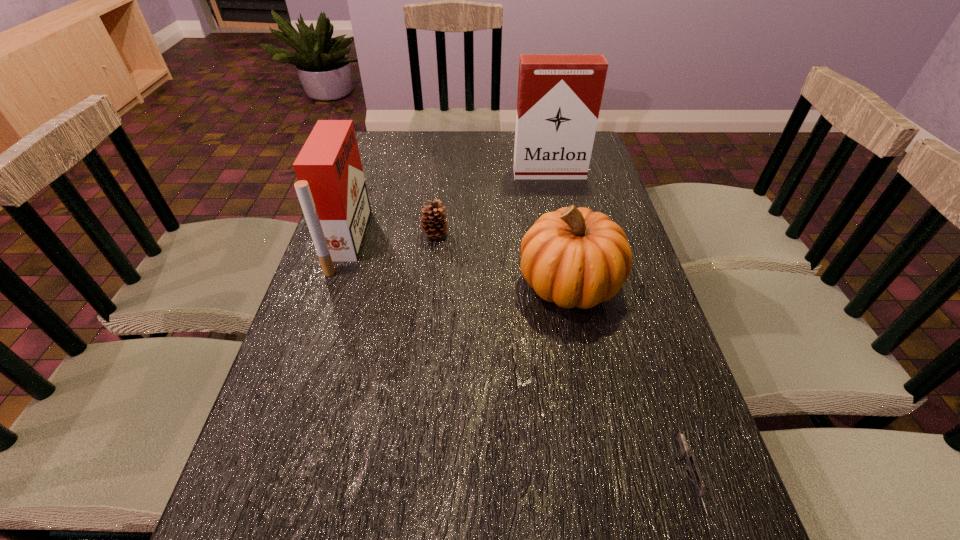
Where is `free space at the far left corner of the desktop`? The width and height of the screenshot is (960, 540). free space at the far left corner of the desktop is located at coordinates (384, 159).

Identify the location of vacant point located between the shorter cigarette case and the taller cigarette case. (448, 207).

Locate an element on the screen. free space that is in between the leftmost object and the tallest object is located at coordinates (448, 207).

I want to click on free spot between the farthest object and the second object from left to right, so click(x=492, y=204).

I want to click on vacant point located between the pumpkin and the left cigarette case, so click(458, 262).

Find the location of a particular element. vacant space that is in between the fourth tallest object and the taller cigarette case is located at coordinates [x=492, y=204].

At what (x,y) coordinates should I click in order to perform the action: click on free space between the leftmost object and the third tallest object. Please return your answer as a coordinate pair (x, y). Looking at the image, I should click on (458, 262).

Locate an element on the screen. This screenshot has height=540, width=960. vacant area between the shortest object and the farther cigarette case is located at coordinates (619, 326).

Identify the location of unoccupied position between the pinecone and the farthest object. (492, 204).

Find the location of a particular element. free area in between the pumpkin and the nearest object is located at coordinates (629, 381).